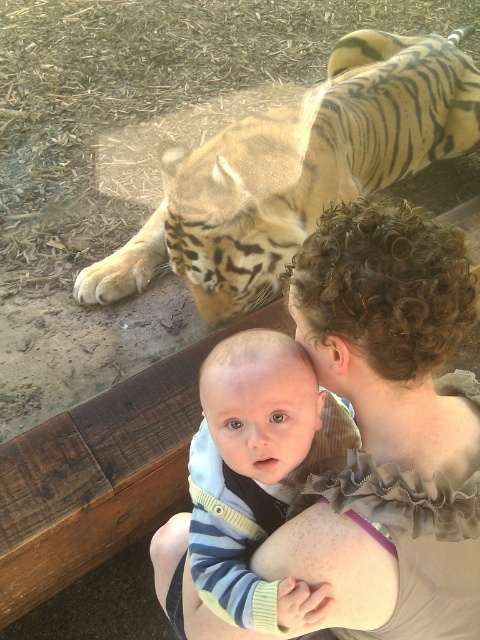
You are a photographer trying to capture a clear shot of the striped knit sweater at center without the curly hair at upper right blocking it. Based on their positions, can you adjust your camera angle to achieve this?

The curly hair at upper right is taller than the striped knit sweater at center, so lowering the camera angle might help avoid the curly hair at upper right blocking the view of the striped knit sweater at center.

You are a photographer setting up a shot with a baby and a tiger. You need to ensure the golden fur tiger at upper left and the striped knit sweater at center are both visible. Based on their positions, which object is closer to the camera?

The golden fur tiger at upper left is positioned over the striped knit sweater at center, so it is closer to the camera.